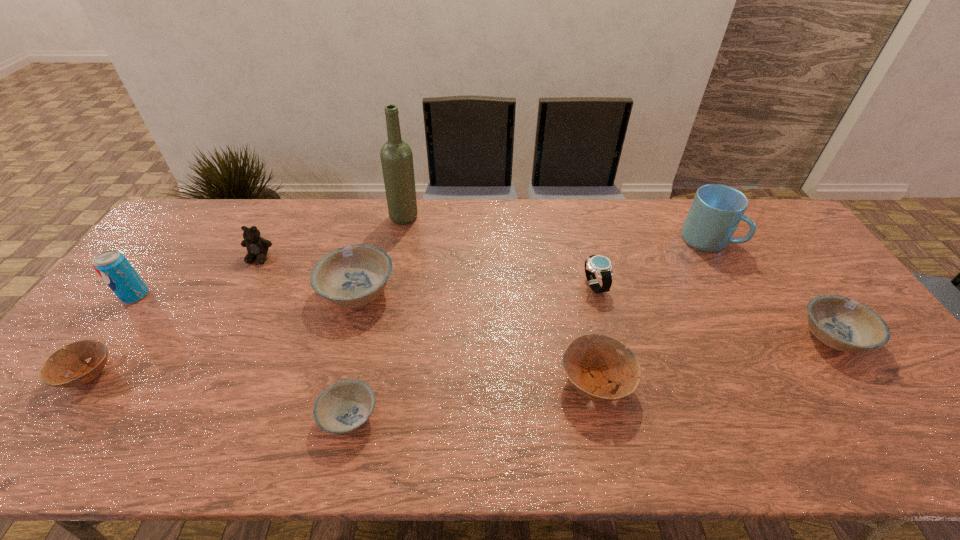
Where is `empty space between the silver watch and the rightmost blue bowl`? This screenshot has width=960, height=540. empty space between the silver watch and the rightmost blue bowl is located at coordinates (713, 311).

Where is `vacant space that's between the teddy bear and the silver watch`? This screenshot has height=540, width=960. vacant space that's between the teddy bear and the silver watch is located at coordinates (426, 272).

Find the location of a particular element. This screenshot has height=540, width=960. free space between the silver watch and the green wine bottle is located at coordinates (499, 252).

This screenshot has height=540, width=960. I want to click on vacant space that's between the rightmost blue bowl and the bigger brown bowl, so click(x=714, y=360).

Locate an element on the screen. vacant region between the teddy bear and the watch is located at coordinates (426, 272).

Select which object is the sixth closest to the wine bottle. Please provide its 2D coordinates. Your answer should be formatted as a tuple, i.e. [(x, y)], where the tuple contains the x and y coordinates of a point satisfying the conditions above.

[(113, 267)]

Identify which object is located as the second nearest to the soda can. Please provide its 2D coordinates. Your answer should be formatted as a tuple, i.e. [(x, y)], where the tuple contains the x and y coordinates of a point satisfying the conditions above.

[(257, 247)]

Locate which bowl is the fifth closest to the second object from right to left. Please provide its 2D coordinates. Your answer should be formatted as a tuple, i.e. [(x, y)], where the tuple contains the x and y coordinates of a point satisfying the conditions above.

[(53, 371)]

Choose which bowl is the nearest neighbor to the third object from left to right. Please provide its 2D coordinates. Your answer should be formatted as a tuple, i.e. [(x, y)], where the tuple contains the x and y coordinates of a point satisfying the conditions above.

[(352, 276)]

Locate which blue bowl is the closest to the smallest blue bowl. Please provide its 2D coordinates. Your answer should be formatted as a tuple, i.e. [(x, y)], where the tuple contains the x and y coordinates of a point satisfying the conditions above.

[(352, 276)]